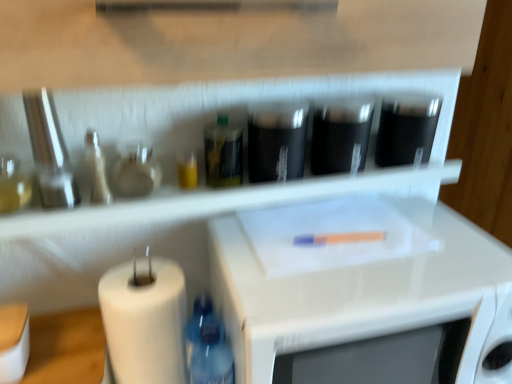
Where is `vacant space situated above white glossy microwave at center (from a real-world perspective)`? Image resolution: width=512 pixels, height=384 pixels. vacant space situated above white glossy microwave at center (from a real-world perspective) is located at coordinates (356, 248).